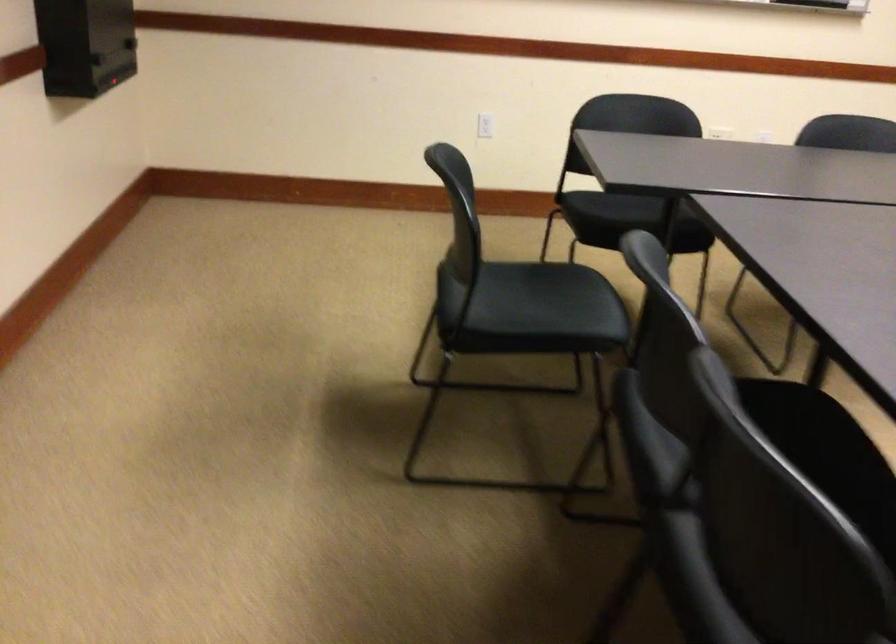
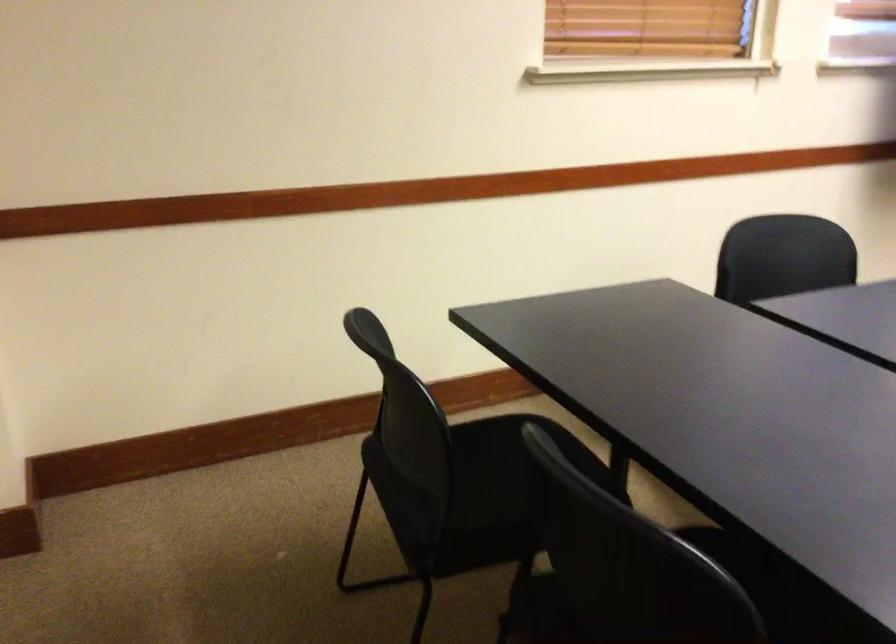
The first image is from the beginning of the video and the second image is from the end. How did the camera likely rotate when shooting the video?

The camera's rotation is toward right-down.